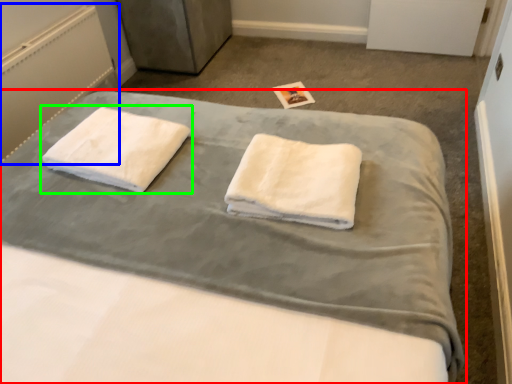
Question: Based on their relative distances, which object is nearer to bed (highlighted by a red box)? Choose from radiator (highlighted by a blue box) and towel (highlighted by a green box).

Choices:
 (A) radiator
 (B) towel

Answer: (B)